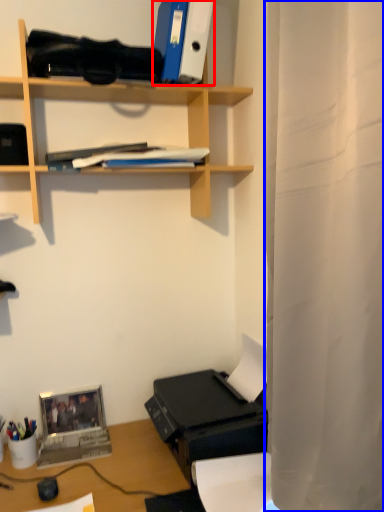
Question: Which object is closer to the camera taking this photo, paperback book (highlighted by a red box) or shower curtain (highlighted by a blue box)?

Choices:
 (A) paperback book
 (B) shower curtain

Answer: (B)